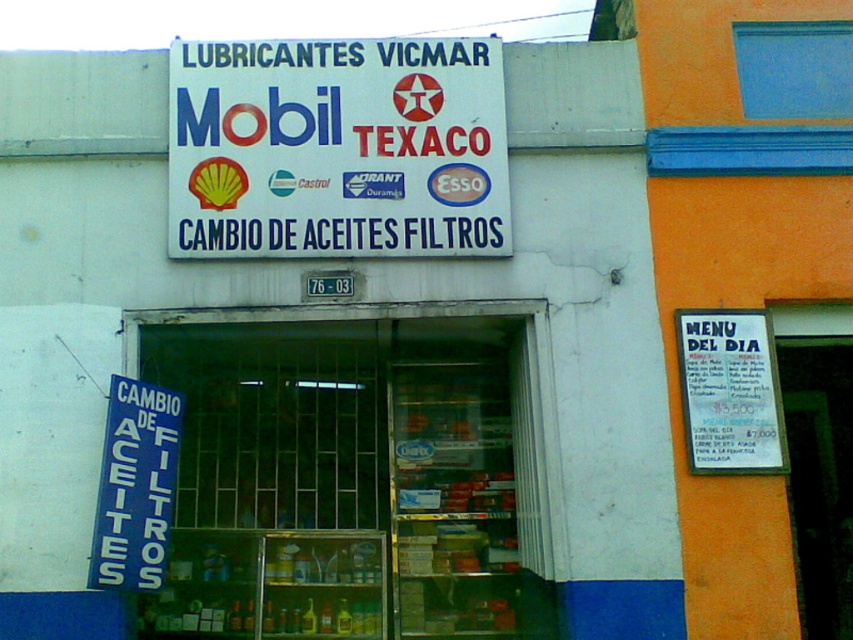
You are a customer approaching the storefront and want to enter the business. You see the transparent glass door at center and the blue plastic sign at lower left. Which object is positioned to the right of the other?

The transparent glass door at center is to the right of blue plastic sign at lower left.

You are standing in front of the lubricant store, and you need to locate the point marked as point (337, 148). According to the scene description, where would this point be located?

The point (337, 148) is on the white paper sign at upper center.